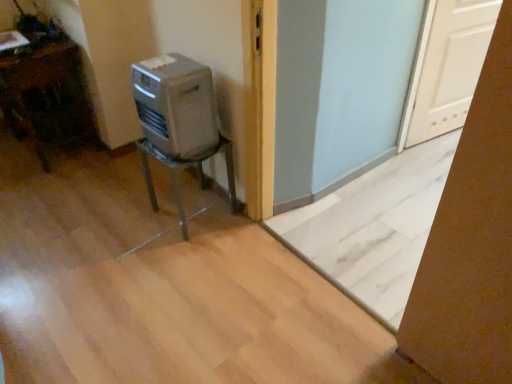
This screenshot has width=512, height=384. I want to click on white matte door at upper right, so click(451, 66).

How much space does metallic gray chair at center-left, which is the first furniture in right-to-left order, occupy horizontally?

It is 34.04 centimeters.

What do you see at coordinates (184, 169) in the screenshot? Image resolution: width=512 pixels, height=384 pixels. I see `metallic gray chair at center-left, which is the first furniture in right-to-left order` at bounding box center [184, 169].

Where is `wooden table at left, the 2th furniture positioned from the right`? wooden table at left, the 2th furniture positioned from the right is located at coordinates (47, 97).

Can you tell me how much wooden table at left, the 2th furniture positioned from the right, and silver metallic heater at center differ in facing direction?

The angle between the facing direction of wooden table at left, the 2th furniture positioned from the right, and the facing direction of silver metallic heater at center is 1.09 degrees.

Is the position of wooden table at left, the 2th furniture positioned from the right, less distant than that of silver metallic heater at center?

No, it is not.

Does wooden table at left, which is the first furniture in left-to-right order, have a greater height compared to silver metallic heater at center?

A: Correct, wooden table at left, which is the first furniture in left-to-right order, is much taller as silver metallic heater at center.

Is point (164, 165) positioned behind point (455, 24)?

No, (164, 165) is in front of (455, 24).

Is metallic gray chair at center-left, which appears as the 2th furniture when viewed from the left, facing towards white matte door at upper right?

No.

From the image's perspective, between metallic gray chair at center-left, which is the first furniture in right-to-left order, and white matte door at upper right, which one is located above?

white matte door at upper right appears higher in the image.

In the scene shown: Is metallic gray chair at center-left, which is the first furniture in right-to-left order, to the left or to the right of white matte door at upper right in the image?

From the image, it's evident that metallic gray chair at center-left, which is the first furniture in right-to-left order, is to the left of white matte door at upper right.

The image size is (512, 384). Find the location of `furniture in front of the wooden table at left, which is the first furniture in left-to-right order`. furniture in front of the wooden table at left, which is the first furniture in left-to-right order is located at coordinates (184, 169).

How many degrees apart are the facing directions of wooden table at left, the 2th furniture positioned from the right, and metallic gray chair at center-left, which appears as the 2th furniture when viewed from the left?

The facing directions of wooden table at left, the 2th furniture positioned from the right, and metallic gray chair at center-left, which appears as the 2th furniture when viewed from the left, are 1.2 degrees apart.

Is wooden table at left, which is the first furniture in left-to-right order, at the left side of metallic gray chair at center-left, which appears as the 2th furniture when viewed from the left?

Correct, you'll find wooden table at left, which is the first furniture in left-to-right order, to the left of metallic gray chair at center-left, which appears as the 2th furniture when viewed from the left.

Considering the sizes of objects wooden table at left, the 2th furniture positioned from the right, and metallic gray chair at center-left, which is the first furniture in right-to-left order, in the image provided, who is shorter, wooden table at left, the 2th furniture positioned from the right, or metallic gray chair at center-left, which is the first furniture in right-to-left order,?

With less height is metallic gray chair at center-left, which is the first furniture in right-to-left order.

Can you confirm if wooden table at left, the 2th furniture positioned from the right, is taller than white matte door at upper right?

Incorrect, the height of wooden table at left, the 2th furniture positioned from the right, is not larger of that of white matte door at upper right.

Is wooden table at left, which is the first furniture in left-to-right order, not near white matte door at upper right?

Yes, wooden table at left, which is the first furniture in left-to-right order, and white matte door at upper right are quite far apart.

Is white matte door at upper right inside wooden table at left, which is the first furniture in left-to-right order?

No, white matte door at upper right is not surrounded by wooden table at left, which is the first furniture in left-to-right order.

Considering the positions of objects wooden table at left, the 2th furniture positioned from the right, and white matte door at upper right in the image provided, who is more to the right, wooden table at left, the 2th furniture positioned from the right, or white matte door at upper right?

From the viewer's perspective, white matte door at upper right appears more on the right side.

Is silver metallic heater at center not close to wooden table at left, which is the first furniture in left-to-right order?

No, there isn't a large distance between silver metallic heater at center and wooden table at left, which is the first furniture in left-to-right order.

Would you say silver metallic heater at center is outside wooden table at left, which is the first furniture in left-to-right order?

silver metallic heater at center is positioned outside wooden table at left, which is the first furniture in left-to-right order.

From the image's perspective, which one is positioned lower, silver metallic heater at center or wooden table at left, the 2th furniture positioned from the right?

silver metallic heater at center, from the image's perspective.

Locate an element on the screen. The width and height of the screenshot is (512, 384). home appliance below the wooden table at left, which is the first furniture in left-to-right order (from the image's perspective) is located at coordinates (176, 106).

Is white matte door at upper right facing towards silver metallic heater at center?

No, white matte door at upper right is not facing towards silver metallic heater at center.

Considering the positions of objects white matte door at upper right and silver metallic heater at center in the image provided, who is more to the right, white matte door at upper right or silver metallic heater at center?

white matte door at upper right.

From a real-world perspective, is white matte door at upper right positioned over silver metallic heater at center based on gravity?

No, from a real-world perspective, white matte door at upper right is not over silver metallic heater at center

Does silver metallic heater at center have a smaller size compared to metallic gray chair at center-left, which is the first furniture in right-to-left order?

Indeed, silver metallic heater at center has a smaller size compared to metallic gray chair at center-left, which is the first furniture in right-to-left order.

Where is `home appliance above the metallic gray chair at center-left, which is the first furniture in right-to-left order (from a real-world perspective)`? The width and height of the screenshot is (512, 384). home appliance above the metallic gray chair at center-left, which is the first furniture in right-to-left order (from a real-world perspective) is located at coordinates (176, 106).

In terms of width, does silver metallic heater at center look wider or thinner when compared to metallic gray chair at center-left, which is the first furniture in right-to-left order?

In the image, silver metallic heater at center appears to be more narrow than metallic gray chair at center-left, which is the first furniture in right-to-left order.

From the image's perspective, would you say silver metallic heater at center is positioned over metallic gray chair at center-left, which appears as the 2th furniture when viewed from the left?

Correct, silver metallic heater at center appears higher than metallic gray chair at center-left, which appears as the 2th furniture when viewed from the left, in the image.

The width and height of the screenshot is (512, 384). I want to click on home appliance that appears above the wooden table at left, the 2th furniture positioned from the right (from a real-world perspective), so click(176, 106).

This screenshot has height=384, width=512. I want to click on furniture that is the 2nd object located below the white matte door at upper right (from the image's perspective), so click(x=184, y=169).

Looking at the image, which one is located further to silver metallic heater at center, metallic gray chair at center-left, which is the first furniture in right-to-left order, or wooden table at left, which is the first furniture in left-to-right order?

The object further to silver metallic heater at center is wooden table at left, which is the first furniture in left-to-right order.

From the image, which object appears to be farther from wooden table at left, which is the first furniture in left-to-right order, brown cardboard box at lower right or silver metallic heater at center?

brown cardboard box at lower right is further to wooden table at left, which is the first furniture in left-to-right order.

When comparing their distances from wooden table at left, the 2th furniture positioned from the right, does white matte door at upper right or brown cardboard box at lower right seem closer?

white matte door at upper right.

Looking at the image, which one is located further to brown cardboard box at lower right, silver metallic heater at center or wooden table at left, which is the first furniture in left-to-right order?

The object further to brown cardboard box at lower right is wooden table at left, which is the first furniture in left-to-right order.

Looking at the image, which one is located closer to wooden table at left, the 2th furniture positioned from the right, white matte door at upper right or metallic gray chair at center-left, which appears as the 2th furniture when viewed from the left?

metallic gray chair at center-left, which appears as the 2th furniture when viewed from the left.

Estimate the real-world distances between objects in this image. Which object is closer to metallic gray chair at center-left, which is the first furniture in right-to-left order, white matte door at upper right or silver metallic heater at center?

silver metallic heater at center is closer to metallic gray chair at center-left, which is the first furniture in right-to-left order.

Estimate the real-world distances between objects in this image. Which object is further from white matte door at upper right, wooden table at left, the 2th furniture positioned from the right, or metallic gray chair at center-left, which appears as the 2th furniture when viewed from the left?

The object further to white matte door at upper right is wooden table at left, the 2th furniture positioned from the right.

When comparing their distances from silver metallic heater at center, does white matte door at upper right or brown cardboard box at lower right seem closer?

brown cardboard box at lower right lies closer to silver metallic heater at center than the other object.

At what (x,y) coordinates should I click in order to perform the action: click on home appliance between wooden table at left, which is the first furniture in left-to-right order, and brown cardboard box at lower right. Please return your answer as a coordinate pair (x, y). This screenshot has height=384, width=512. Looking at the image, I should click on (176, 106).

Locate an element on the screen. Image resolution: width=512 pixels, height=384 pixels. home appliance situated between wooden table at left, which is the first furniture in left-to-right order, and metallic gray chair at center-left, which appears as the 2th furniture when viewed from the left, from left to right is located at coordinates 176,106.

I want to click on home appliance located between brown cardboard box at lower right and white matte door at upper right in the depth direction, so click(176, 106).

Identify the location of furniture between silver metallic heater at center and white matte door at upper right from left to right. (184, 169).